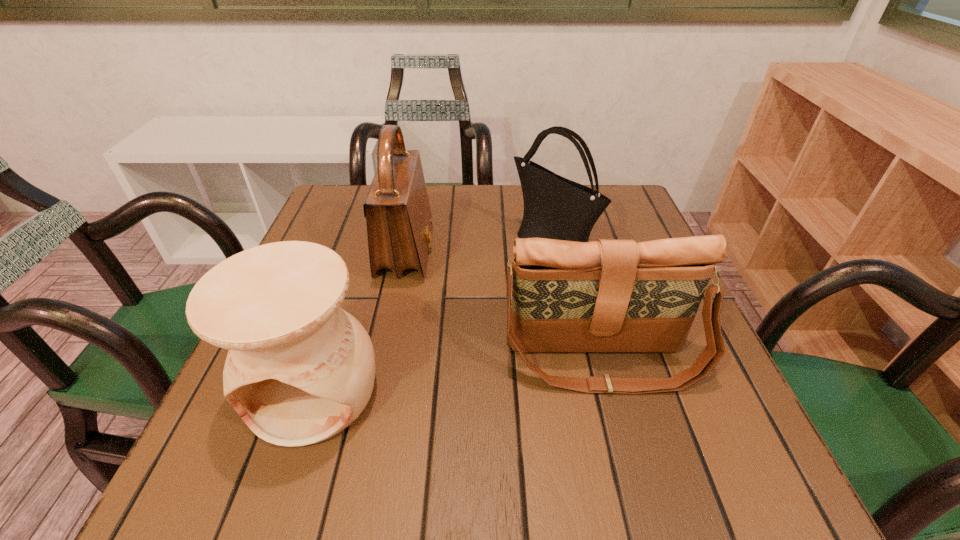
Identify which shoulder bag is the nearest to the pottery. Please provide its 2D coordinates. Your answer should be formatted as a tuple, i.e. [(x, y)], where the tuple contains the x and y coordinates of a point satisfying the conditions above.

[(399, 222)]

Image resolution: width=960 pixels, height=540 pixels. What are the coordinates of `shoulder bag that is the second nearest to the leftmost shoulder bag` in the screenshot? It's located at (606, 295).

Identify the location of free spot that satisfies the following two spatial constraints: 1. on the front flap of the leftmost shoulder bag; 2. at the open side of the pottery. (377, 389).

Where is `vacant area that satisfies the following two spatial constraints: 1. on the front flap of the leftmost shoulder bag; 2. at the open side of the pottery`? vacant area that satisfies the following two spatial constraints: 1. on the front flap of the leftmost shoulder bag; 2. at the open side of the pottery is located at coordinates 377,389.